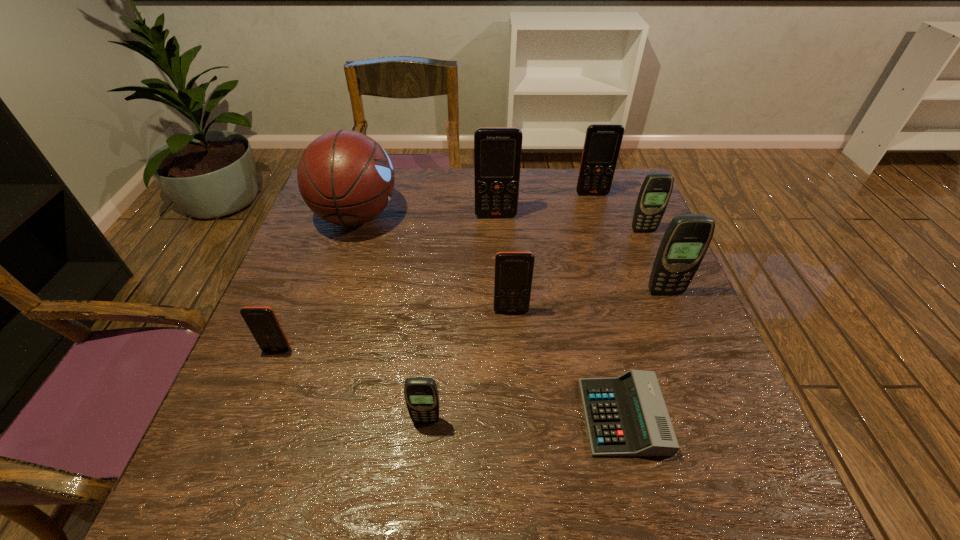
This screenshot has width=960, height=540. What are the coordinates of `the tallest cellular telephone` in the screenshot? It's located at (497, 150).

This screenshot has height=540, width=960. Identify the location of the second farthest orange cellular telephone. (497, 150).

This screenshot has width=960, height=540. Identify the location of basketball. (345, 177).

This screenshot has height=540, width=960. Find the location of `the third cellular telephone from right to left`. the third cellular telephone from right to left is located at coordinates (x=602, y=143).

The image size is (960, 540). In order to click on the farthest cellular telephone in this screenshot , I will do `click(602, 143)`.

What are the coordinates of `the biggest gray cellular telephone` in the screenshot? It's located at (687, 238).

In order to click on the fourth farthest cellular telephone in this screenshot , I will do click(x=687, y=238).

The height and width of the screenshot is (540, 960). Find the location of `the farthest gray cellular telephone`. the farthest gray cellular telephone is located at coordinates (655, 192).

Find the location of `the third farthest cellular telephone`. the third farthest cellular telephone is located at coordinates (655, 192).

Locate an element on the screen. The height and width of the screenshot is (540, 960). the third farthest orange cellular telephone is located at coordinates (513, 277).